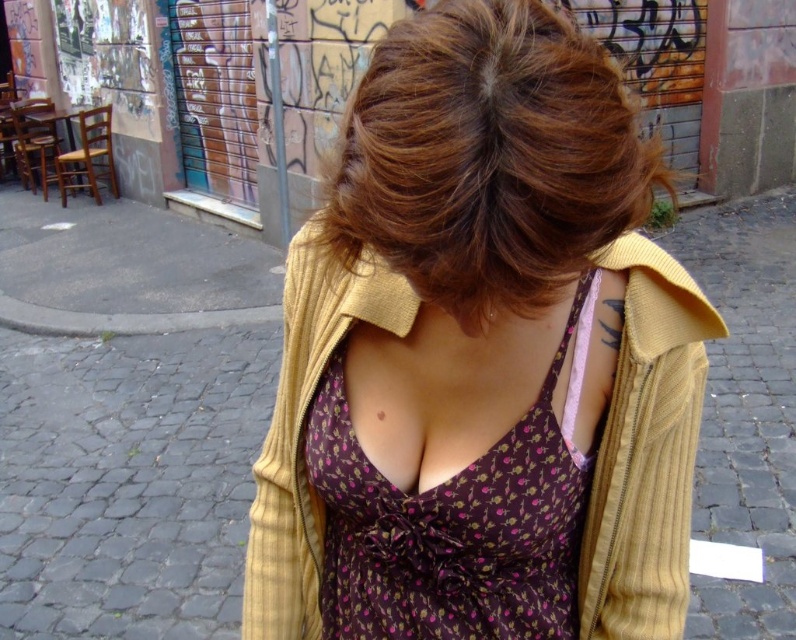
You are a fashion designer observing a model wearing the yellow ribbed sweater at center. You want to take a closer look at the sweater without moving closer than 20 inches. Can you examine it from your current position?

The yellow ribbed sweater at center is 19.53 inches away from viewer, so you are already within the 20 inches distance and can examine it from your current position.

You are a fashion designer observing a person in an urban setting. You notice the brown textured hair at center and the purple floral fabric dress at center. Which of these two items appears narrower from your perspective?

The brown textured hair at center appears narrower than the purple floral fabric dress at center because it has a lesser width compared to the dress.